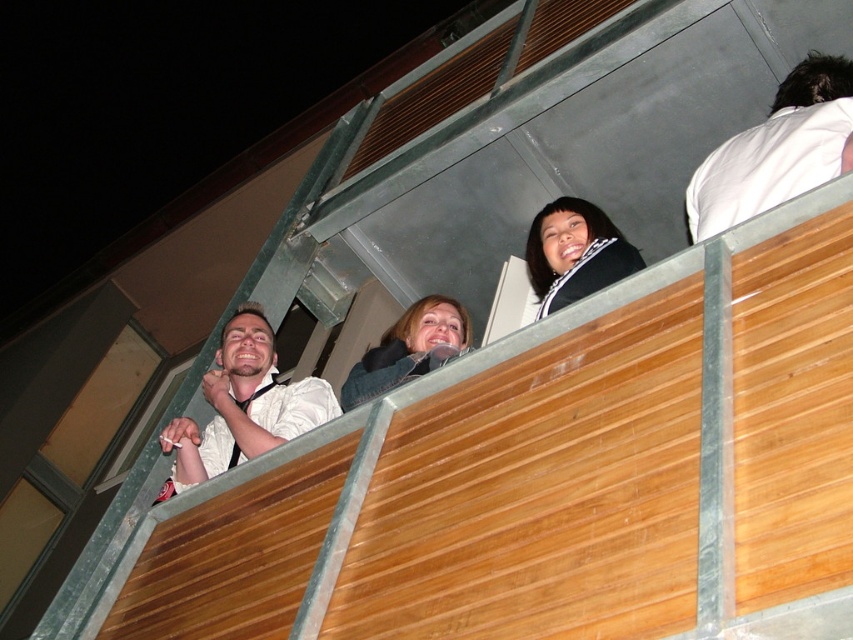
Question: Based on their relative distances, which object is nearer to the white matte shirt at left?

Choices:
 (A) matte blue jacket at center
 (B) white matte shirt at upper right
 (C) black satin scarf at upper center

Answer: (A)

Question: Does black satin scarf at upper center lie in front of matte blue jacket at center?

Choices:
 (A) no
 (B) yes

Answer: (B)

Question: From the image, what is the correct spatial relationship of white matte shirt at upper right in relation to white matte shirt at left?

Choices:
 (A) below
 (B) above

Answer: (B)

Question: Can you confirm if black satin scarf at upper center is thinner than matte blue jacket at center?

Choices:
 (A) no
 (B) yes

Answer: (B)

Question: Which point is farther from the camera taking this photo?

Choices:
 (A) (257, 323)
 (B) (426, 308)
 (C) (593, 252)
 (D) (689, 218)

Answer: (A)

Question: Which object appears farthest from the camera in this image?

Choices:
 (A) matte blue jacket at center
 (B) white matte shirt at left
 (C) black satin scarf at upper center
 (D) white matte shirt at upper right

Answer: (B)